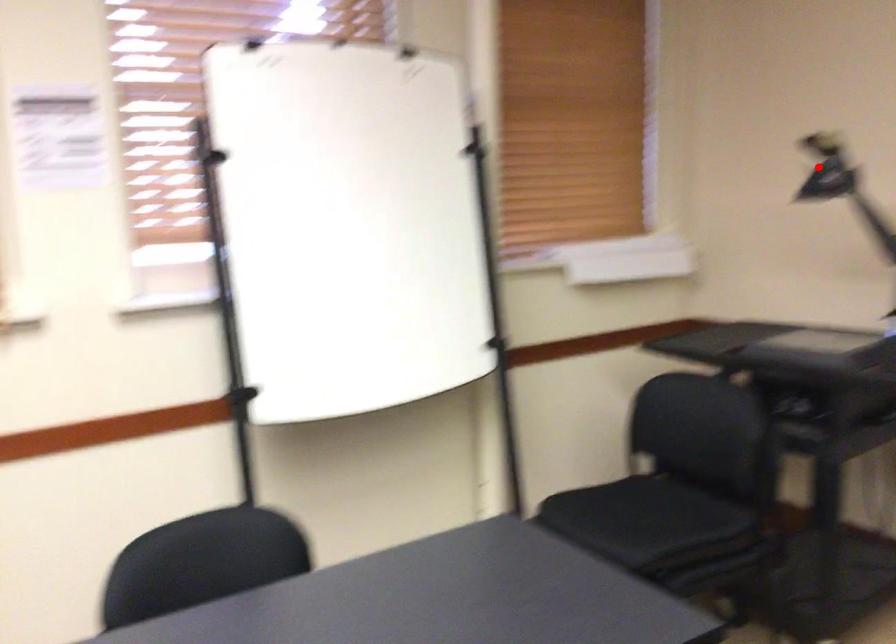
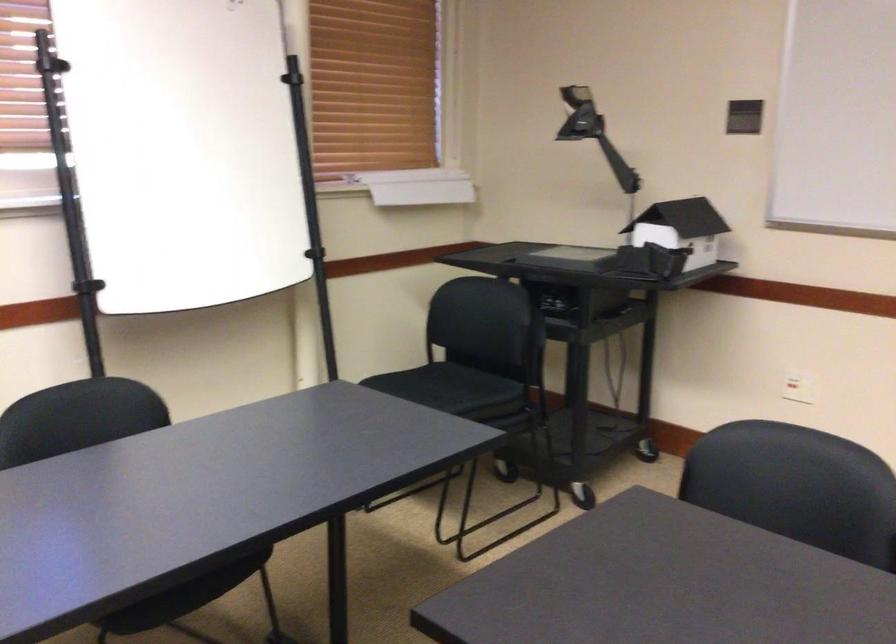
The point at the highlighted location is marked in the first image. Where is the corresponding point in the second image?

(579, 115)